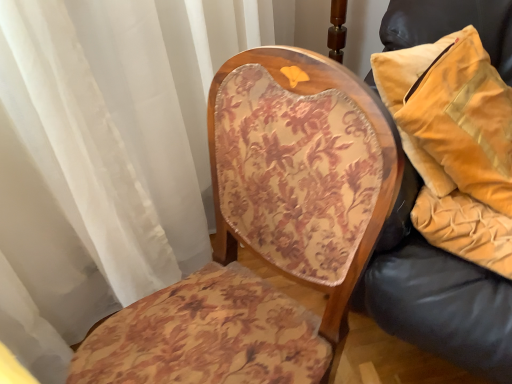
Question: Would you say velvet/yellow pillow at right is inside or outside floral-patterned fabric chair at center?

Choices:
 (A) inside
 (B) outside

Answer: (B)

Question: From a real-world perspective, is velvet/yellow pillow at right physically located above or below floral-patterned fabric chair at center?

Choices:
 (A) below
 (B) above

Answer: (B)

Question: Based on their relative distances, which object is nearer to the velvet yellow pillow at right?

Choices:
 (A) velvet/yellow pillow at right
 (B) floral-patterned fabric chair at center

Answer: (A)

Question: Which object is the closest to the velvet yellow pillow at right?

Choices:
 (A) floral-patterned fabric chair at center
 (B) velvet/yellow pillow at right

Answer: (B)